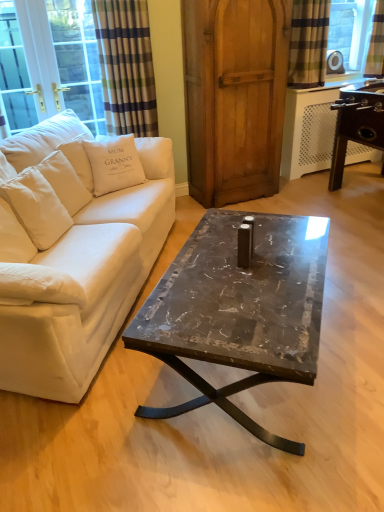
Question: Could you tell me if plaid fabric curtain at upper right, which is the 2th curtain in left-to-right order, is facing plaid fabric curtain at upper left, the 1th curtain from the left?

Choices:
 (A) yes
 (B) no

Answer: (B)

Question: Considering the relative positions of plaid fabric curtain at upper right, marked as the 2th curtain in a right-to-left arrangement, and plaid fabric curtain at upper left, the 1th curtain from the left, in the image provided, is plaid fabric curtain at upper right, marked as the 2th curtain in a right-to-left arrangement, behind plaid fabric curtain at upper left, the 1th curtain from the left,?

Choices:
 (A) no
 (B) yes

Answer: (B)

Question: Can you confirm if plaid fabric curtain at upper right, which is the 2th curtain in left-to-right order, is thinner than plaid fabric curtain at upper left, the 1th curtain from the left?

Choices:
 (A) no
 (B) yes

Answer: (A)

Question: Considering the relative sizes of plaid fabric curtain at upper right, marked as the 2th curtain in a right-to-left arrangement, and plaid fabric curtain at upper left, the third curtain positioned from the right, in the image provided, is plaid fabric curtain at upper right, marked as the 2th curtain in a right-to-left arrangement, wider than plaid fabric curtain at upper left, the third curtain positioned from the right,?

Choices:
 (A) yes
 (B) no

Answer: (A)

Question: Is plaid fabric curtain at upper right, marked as the 2th curtain in a right-to-left arrangement, to the right of plaid fabric curtain at upper left, the third curtain positioned from the right, from the viewer's perspective?

Choices:
 (A) no
 (B) yes

Answer: (B)

Question: In terms of size, does white fabric cushion at left appear bigger or smaller than wooden armoire at center?

Choices:
 (A) big
 (B) small

Answer: (B)

Question: Which is correct: white fabric cushion at left is inside wooden armoire at center, or outside of it?

Choices:
 (A) outside
 (B) inside

Answer: (A)

Question: From the image's perspective, is white fabric cushion at left above or below wooden armoire at center?

Choices:
 (A) above
 (B) below

Answer: (A)

Question: In terms of width, does white fabric cushion at left look wider or thinner when compared to wooden armoire at center?

Choices:
 (A) thin
 (B) wide

Answer: (A)

Question: Based on their sizes in the image, would you say white fabric cushion at left is bigger or smaller than white cotton pillow at upper left?

Choices:
 (A) small
 (B) big

Answer: (B)

Question: Relative to white cotton pillow at upper left, is white fabric cushion at left in front or behind?

Choices:
 (A) front
 (B) behind

Answer: (B)

Question: Considering the positions of point (66, 31) and point (142, 181), is point (66, 31) closer or farther from the camera than point (142, 181)?

Choices:
 (A) closer
 (B) farther

Answer: (B)

Question: Choose the correct answer: Is white fabric cushion at left inside white cotton pillow at upper left or outside it?

Choices:
 (A) inside
 (B) outside

Answer: (B)

Question: From the image's perspective, relative to plaid fabric curtain at upper right, which is the 2th curtain in left-to-right order, is white cotton pillow at upper left above or below?

Choices:
 (A) above
 (B) below

Answer: (B)

Question: In terms of width, does white cotton pillow at upper left look wider or thinner when compared to plaid fabric curtain at upper right, marked as the 2th curtain in a right-to-left arrangement?

Choices:
 (A) wide
 (B) thin

Answer: (A)